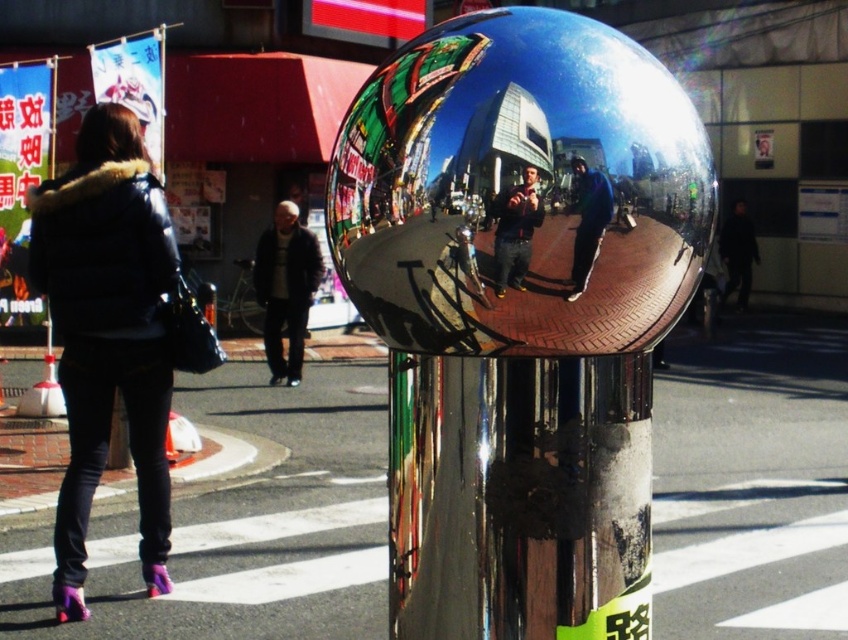
Consider the image. Is dark blue jeans at center bigger than blue reflective jacket at center?

Actually, dark blue jeans at center might be smaller than blue reflective jacket at center.

The width and height of the screenshot is (848, 640). Find the location of `dark blue jeans at center`. dark blue jeans at center is located at coordinates (515, 230).

Is point (509, 209) positioned after point (573, 278)?

No, it is not.

You are a GUI agent. You are given a task and a screenshot of the screen. Output one action in this format:
    pyautogui.click(x=<x>, y=<y>)
    Task: Click on the dark blue jeans at center
    
    Given the screenshot: What is the action you would take?
    pyautogui.click(x=515, y=230)

Which of these two, matte black jacket at left or dark blue jeans at center, stands shorter?

Standing shorter between the two is dark blue jeans at center.

Is point (168, 387) behind point (500, 232)?

Yes, point (168, 387) is behind point (500, 232).

Locate an element on the screen. This screenshot has height=640, width=848. matte black jacket at left is located at coordinates (107, 333).

Does dark gray fabric jacket at center lie in front of dark blue jeans at center?

No.

Can you confirm if dark gray fabric jacket at center is positioned to the left of dark blue jeans at center?

Correct, you'll find dark gray fabric jacket at center to the left of dark blue jeans at center.

From the picture: Who is more forward, (271,360) or (511,237)?

Point (511,237) is in front.

The image size is (848, 640). I want to click on dark gray fabric jacket at center, so click(x=285, y=289).